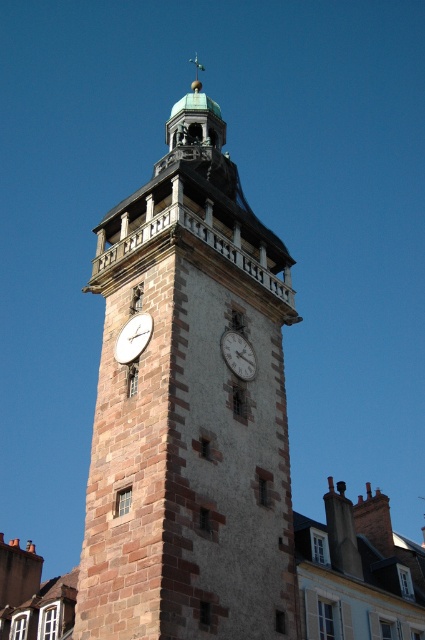
Question: Which of the following is the closest to the observer?

Choices:
 (A) (122, 328)
 (B) (200, 525)

Answer: (B)

Question: Is matte brown clock at center behind matte stone clock at center?

Choices:
 (A) yes
 (B) no

Answer: (B)

Question: Which of these objects is positioned farthest from the brown stone clock tower at center?

Choices:
 (A) matte stone clock at center
 (B) matte brown clock at center

Answer: (B)

Question: Considering the real-world distances, which object is farthest from the matte stone clock at center?

Choices:
 (A) matte brown clock at center
 (B) brown stone clock tower at center

Answer: (B)

Question: Where is brown stone clock tower at center located in relation to matte brown clock at center in the image?

Choices:
 (A) above
 (B) below

Answer: (A)

Question: Does matte brown clock at center appear on the right side of matte stone clock at center?

Choices:
 (A) no
 (B) yes

Answer: (A)